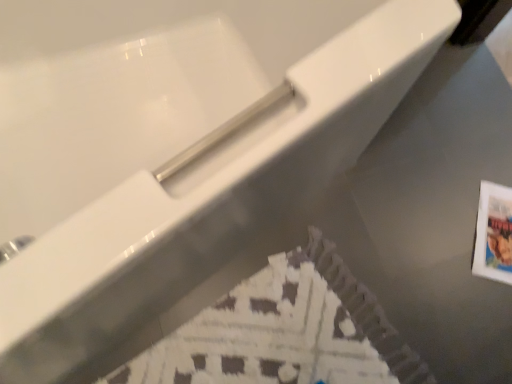
Find the location of a particular element. This screenshot has width=512, height=384. vacant space behind white paper flyer at lower center is located at coordinates (354, 220).